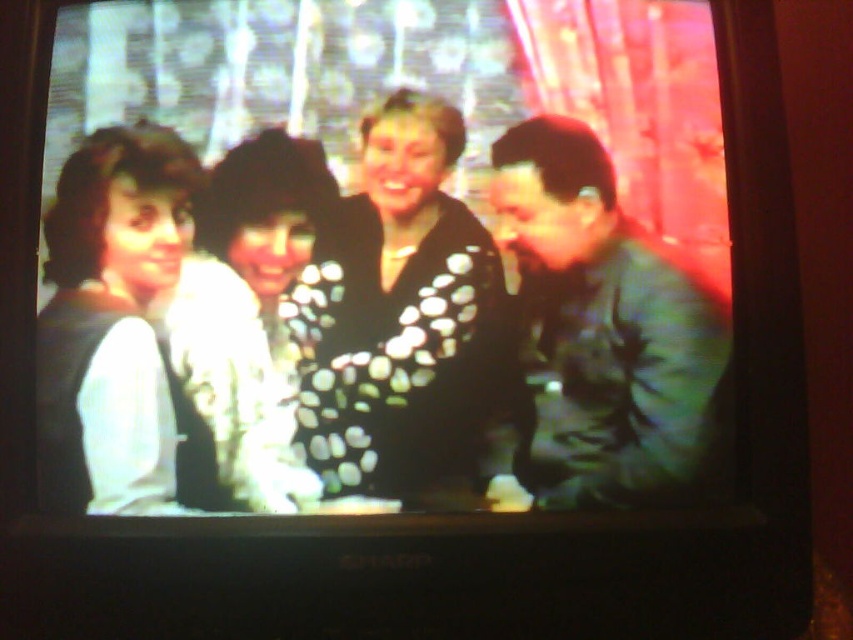
You are a fashion designer analyzing the TV image. You need to determine the spatial relationship between the black dotted sweater at center and the green matte jacket at right. Which one is closer to the camera?

The black dotted sweater at center is closer to the camera because it is in front of the green matte jacket at right.

In the scene shown: You are a fashion designer observing the TV screen. You notice the black dotted sweater at center and the green matte jacket at right. Which clothing item is positioned closer to the left side of the TV screen?

The black dotted sweater at center is positioned to the left of the green matte jacket at right, so it is closer to the left side of the TV screen.

You are standing in front of a SHARP TV screen and want to locate the green matte jacket at right. Based on the coordinates provided, where exactly should you look on the TV screen?

The green matte jacket at right is located at the 2D coordinates point (602, 330) on the TV screen.